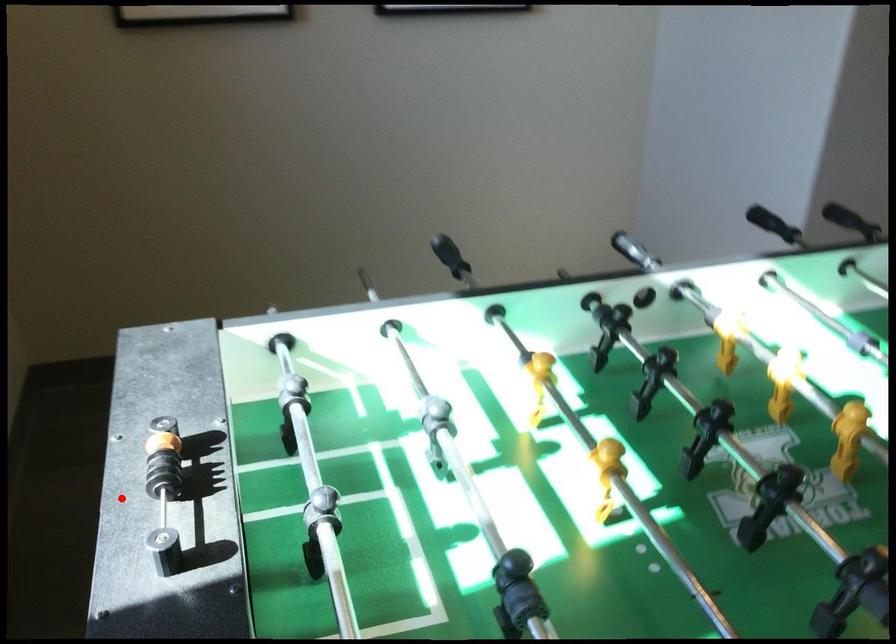
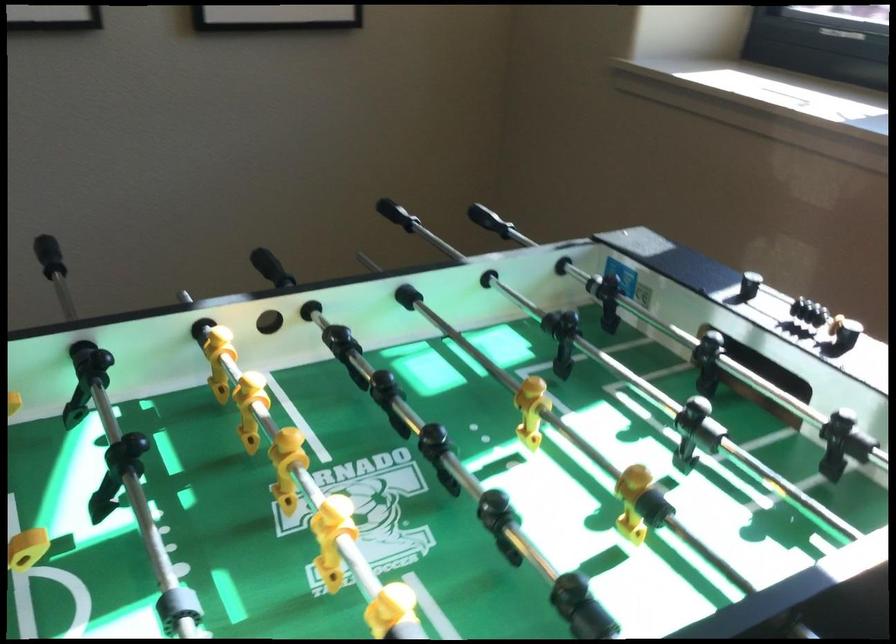
Question: I am providing you with two images of the same scene from different viewpoints. Image1 has a red point marked. In image2, the corresponding 3D location appears at what relative position? Reply with the corresponding letter.

Choices:
 (A) Closer
 (B) Farther

Answer: (B)